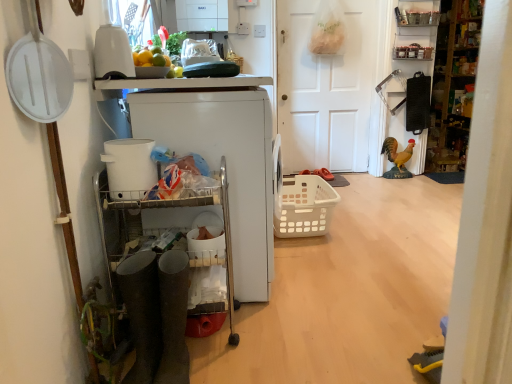
Question: Is white plastic bucket at left, positioned as the 1th appliance in front-to-back order, smaller than metallic silver shelf at upper right, placed as the 2th shelf when sorted from bottom to top?

Choices:
 (A) no
 (B) yes

Answer: (B)

Question: From a real-world perspective, does white plastic bucket at left, placed as the third appliance when sorted from back to front, stand above metallic silver shelf at upper right, which is the 1th shelf in top-to-bottom order?

Choices:
 (A) yes
 (B) no

Answer: (B)

Question: Is white plastic bucket at left, positioned as the 1th appliance in front-to-back order, positioned with its back to metallic silver shelf at upper right, placed as the 2th shelf when sorted from bottom to top?

Choices:
 (A) no
 (B) yes

Answer: (A)

Question: Considering the relative positions of white plastic bucket at left, placed as the third appliance when sorted from back to front, and metallic silver shelf at upper right, placed as the 2th shelf when sorted from bottom to top, in the image provided, is white plastic bucket at left, placed as the third appliance when sorted from back to front, behind metallic silver shelf at upper right, placed as the 2th shelf when sorted from bottom to top,?

Choices:
 (A) no
 (B) yes

Answer: (A)

Question: Does white plastic bucket at left, positioned as the 1th appliance in front-to-back order, have a lesser width compared to metallic silver shelf at upper right, placed as the 2th shelf when sorted from bottom to top?

Choices:
 (A) no
 (B) yes

Answer: (A)

Question: From a real-world perspective, is white plastic bucket at left, placed as the third appliance when sorted from back to front, beneath metallic silver shelf at upper right, which is the 1th shelf in top-to-bottom order?

Choices:
 (A) no
 (B) yes

Answer: (B)

Question: Does white plastic cart at left, which appears as the 3th appliance when viewed from the front, have a greater height compared to metallic silver shelf at upper right, which is the 1th shelf in top-to-bottom order?

Choices:
 (A) no
 (B) yes

Answer: (B)

Question: Is the depth of white plastic cart at left, which appears as the 3th appliance when viewed from the front, less than that of metallic silver shelf at upper right, placed as the 2th shelf when sorted from bottom to top?

Choices:
 (A) no
 (B) yes

Answer: (B)

Question: Is the depth of white plastic cart at left, the 1th appliance viewed from the back, greater than that of metallic silver shelf at upper right, which is the 1th shelf in top-to-bottom order?

Choices:
 (A) no
 (B) yes

Answer: (A)

Question: Is white plastic cart at left, the 1th appliance viewed from the back, at the left side of metallic silver shelf at upper right, which is the 1th shelf in top-to-bottom order?

Choices:
 (A) no
 (B) yes

Answer: (B)

Question: Is metallic silver shelf at upper right, placed as the 2th shelf when sorted from bottom to top, located within white plastic cart at left, which appears as the 3th appliance when viewed from the front?

Choices:
 (A) yes
 (B) no

Answer: (B)

Question: From a real-world perspective, is white plastic cart at left, which appears as the 3th appliance when viewed from the front, positioned over metallic silver shelf at upper right, placed as the 2th shelf when sorted from bottom to top, based on gravity?

Choices:
 (A) no
 (B) yes

Answer: (A)

Question: Is white plastic cart at left, which appears as the 3th appliance when viewed from the front, at the right side of white plastic basket at center?

Choices:
 (A) no
 (B) yes

Answer: (A)